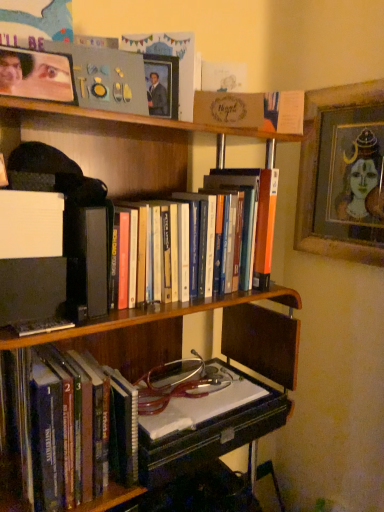
Describe the element at coordinates (141, 124) in the screenshot. I see `wooden bookcase at center` at that location.

I want to click on wooden bookcase at center, so click(x=141, y=124).

This screenshot has width=384, height=512. Describe the element at coordinates (36, 75) in the screenshot. I see `matte plastic picture frame at upper left, the 1th picture frame positioned from the front` at that location.

Based on the photo, how much space does wooden framed portrait at upper right, placed as the 3th picture frame when sorted from left to right, occupy horizontally?

2.06 inches.

At what (x,y) coordinates should I click in order to perform the action: click on wooden picture frame at upper center, positioned as the 2th picture frame in back-to-front order. Please return your answer as a coordinate pair (x, y). This screenshot has height=512, width=384. Looking at the image, I should click on (162, 85).

From the image's perspective, would you say hardcover books at left, which is the 2th book in top-to-bottom order, is positioned over hardcover books at center, arranged as the second book when ordered from the bottom?

No.

Is hardcover books at left, which is the 2th book in top-to-bottom order, not within hardcover books at center, marked as the 1th book in a top-to-bottom arrangement?

Yes, hardcover books at left, which is the 2th book in top-to-bottom order, is located beyond the bounds of hardcover books at center, marked as the 1th book in a top-to-bottom arrangement.

Relative to hardcover books at center, arranged as the second book when ordered from the bottom, is hardcover books at left, which is the 2th book in top-to-bottom order, in front or behind?

In the image, hardcover books at left, which is the 2th book in top-to-bottom order, appears behind hardcover books at center, arranged as the second book when ordered from the bottom.

Can you see hardcover books at left, the first book from the bottom, touching hardcover books at center, marked as the 1th book in a top-to-bottom arrangement?

hardcover books at left, the first book from the bottom, and hardcover books at center, marked as the 1th book in a top-to-bottom arrangement, are clearly separated.

Does wooden bookcase at center appear on the right side of hardcover books at center, marked as the 1th book in a top-to-bottom arrangement?

No.

Which object is thinner, wooden bookcase at center or hardcover books at center, arranged as the second book when ordered from the bottom?

hardcover books at center, arranged as the second book when ordered from the bottom.

From the image's perspective, is wooden bookcase at center positioned above or below hardcover books at center, arranged as the second book when ordered from the bottom?

Clearly, from the image's perspective, wooden bookcase at center is below hardcover books at center, arranged as the second book when ordered from the bottom.

Can we say wooden bookcase at center lies outside hardcover books at center, arranged as the second book when ordered from the bottom?

wooden bookcase at center is positioned outside hardcover books at center, arranged as the second book when ordered from the bottom.

Can you confirm if hardcover books at left, which is the 2th book in top-to-bottom order, is thinner than wooden framed portrait at upper right, the first picture frame positioned from the right?

No, hardcover books at left, which is the 2th book in top-to-bottom order, is not thinner than wooden framed portrait at upper right, the first picture frame positioned from the right.

How different are the orientations of hardcover books at left, the first book from the bottom, and wooden framed portrait at upper right, placed as the 3th picture frame when sorted from left to right, in degrees?

The angular difference between hardcover books at left, the first book from the bottom, and wooden framed portrait at upper right, placed as the 3th picture frame when sorted from left to right, is 85.4 degrees.

Is hardcover books at left, which is the 2th book in top-to-bottom order, not near wooden framed portrait at upper right, the first picture frame viewed from the back?

Yes, hardcover books at left, which is the 2th book in top-to-bottom order, and wooden framed portrait at upper right, the first picture frame viewed from the back, are quite far apart.

In the scene shown: Can we say hardcover books at left, which is the 2th book in top-to-bottom order, lies outside wooden framed portrait at upper right, the first picture frame positioned from the right?

Yes, hardcover books at left, which is the 2th book in top-to-bottom order, is located beyond the bounds of wooden framed portrait at upper right, the first picture frame positioned from the right.

Looking at the image, does matte plastic picture frame at upper left, the 1th picture frame positioned from the front, seem bigger or smaller compared to hardcover books at left, which is the 2th book in top-to-bottom order?

Considering their sizes, matte plastic picture frame at upper left, the 1th picture frame positioned from the front, takes up less space than hardcover books at left, which is the 2th book in top-to-bottom order.

Is matte plastic picture frame at upper left, which is counted as the third picture frame, starting from the right, outside of hardcover books at left, the first book from the bottom?

Yes, matte plastic picture frame at upper left, which is counted as the third picture frame, starting from the right, is outside of hardcover books at left, the first book from the bottom.

Based on their positions, is matte plastic picture frame at upper left, the 1th picture frame positioned from the front, located to the left or right of hardcover books at left, which is the 2th book in top-to-bottom order?

Based on their positions, matte plastic picture frame at upper left, the 1th picture frame positioned from the front, is located to the right of hardcover books at left, which is the 2th book in top-to-bottom order.

Is matte plastic picture frame at upper left, which ranks as the third picture frame in back-to-front order, in contact with hardcover books at left, which is the 2th book in top-to-bottom order?

No, matte plastic picture frame at upper left, which ranks as the third picture frame in back-to-front order, is not beside hardcover books at left, which is the 2th book in top-to-bottom order.

Considering the relative sizes of matte plastic picture frame at upper left, which is counted as the third picture frame, starting from the right, and wooden picture frame at upper center, positioned as the 2th picture frame in back-to-front order, in the image provided, is matte plastic picture frame at upper left, which is counted as the third picture frame, starting from the right, shorter than wooden picture frame at upper center, positioned as the 2th picture frame in back-to-front order,?

No, matte plastic picture frame at upper left, which is counted as the third picture frame, starting from the right, is not shorter than wooden picture frame at upper center, positioned as the 2th picture frame in back-to-front order.

Between point (6, 83) and point (147, 88), which one is positioned behind?

The point (147, 88) is more distant.

Is matte plastic picture frame at upper left, the 1th picture frame viewed from the left, aimed at wooden picture frame at upper center, which is the 2th picture frame from left to right?

No, matte plastic picture frame at upper left, the 1th picture frame viewed from the left, is not oriented towards wooden picture frame at upper center, which is the 2th picture frame from left to right.

Identify the location of book that is the 2nd one when counting upward from the wooden bookcase at center (from the image's perspective). The image size is (384, 512). [x=250, y=218].

Considering the relative positions of hardcover books at center, arranged as the second book when ordered from the bottom, and wooden bookcase at center in the image provided, is hardcover books at center, arranged as the second book when ordered from the bottom, to the left of wooden bookcase at center from the viewer's perspective?

In fact, hardcover books at center, arranged as the second book when ordered from the bottom, is to the right of wooden bookcase at center.

From a real-world perspective, is hardcover books at center, marked as the 1th book in a top-to-bottom arrangement, above or below hardcover books at left, which is the 2th book in top-to-bottom order?

hardcover books at center, marked as the 1th book in a top-to-bottom arrangement, is above hardcover books at left, which is the 2th book in top-to-bottom order.

From the image's perspective, between hardcover books at center, arranged as the second book when ordered from the bottom, and hardcover books at left, the first book from the bottom, which one is located above?

hardcover books at center, arranged as the second book when ordered from the bottom, appears higher in the image.

Which object is further away from the camera, hardcover books at center, marked as the 1th book in a top-to-bottom arrangement, or hardcover books at left, which is the 2th book in top-to-bottom order?

Positioned behind is hardcover books at left, which is the 2th book in top-to-bottom order.

Looking at their sizes, would you say hardcover books at center, arranged as the second book when ordered from the bottom, is wider or thinner than hardcover books at left, the first book from the bottom?

Clearly, hardcover books at center, arranged as the second book when ordered from the bottom, has less width compared to hardcover books at left, the first book from the bottom.

The width and height of the screenshot is (384, 512). I want to click on book on the right of hardcover books at left, the first book from the bottom, so click(250, 218).

At what (x,y) coordinates should I click in order to perform the action: click on book that is the 2nd object located above the wooden bookcase at center (from the image's perspective). Please return your answer as a coordinate pair (x, y). Image resolution: width=384 pixels, height=512 pixels. Looking at the image, I should click on (250, 218).

Estimate the real-world distances between objects in this image. Which object is further from wooden bookcase at center, hardcover books at center, marked as the 1th book in a top-to-bottom arrangement, or matte plastic picture frame at upper left, which is counted as the third picture frame, starting from the right?

matte plastic picture frame at upper left, which is counted as the third picture frame, starting from the right.

Considering their positions, is wooden bookcase at center positioned closer to wooden framed portrait at upper right, placed as the 3th picture frame when sorted from left to right, than hardcover books at left, the first book from the bottom?

wooden bookcase at center is closer to wooden framed portrait at upper right, placed as the 3th picture frame when sorted from left to right.

Which object lies further to the anchor point wooden picture frame at upper center, which is the 2th picture frame from left to right, wooden bookcase at center or hardcover books at center, arranged as the second book when ordered from the bottom?

hardcover books at center, arranged as the second book when ordered from the bottom, lies further to wooden picture frame at upper center, which is the 2th picture frame from left to right, than the other object.

Based on their spatial positions, is wooden picture frame at upper center, the second picture frame positioned from the right, or matte plastic picture frame at upper left, which is counted as the third picture frame, starting from the right, further from wooden framed portrait at upper right, the first picture frame positioned from the right?

matte plastic picture frame at upper left, which is counted as the third picture frame, starting from the right, is further to wooden framed portrait at upper right, the first picture frame positioned from the right.

Which object lies further to the anchor point matte plastic picture frame at upper left, which is counted as the third picture frame, starting from the right, hardcover books at center, arranged as the second book when ordered from the bottom, or wooden bookcase at center?

Based on the image, hardcover books at center, arranged as the second book when ordered from the bottom, appears to be further to matte plastic picture frame at upper left, which is counted as the third picture frame, starting from the right.

Looking at this image, considering their positions, is matte plastic picture frame at upper left, the 1th picture frame positioned from the front, positioned closer to wooden picture frame at upper center, which is the 2th picture frame from left to right, than wooden framed portrait at upper right, which appears as the 3th picture frame when viewed from the front?

matte plastic picture frame at upper left, the 1th picture frame positioned from the front, lies closer to wooden picture frame at upper center, which is the 2th picture frame from left to right, than the other object.

Considering their positions, is matte plastic picture frame at upper left, which ranks as the third picture frame in back-to-front order, positioned further to wooden framed portrait at upper right, the first picture frame viewed from the back, than wooden bookcase at center?

matte plastic picture frame at upper left, which ranks as the third picture frame in back-to-front order, is further to wooden framed portrait at upper right, the first picture frame viewed from the back.

Based on their spatial positions, is hardcover books at center, arranged as the second book when ordered from the bottom, or wooden framed portrait at upper right, the first picture frame positioned from the right, further from matte plastic picture frame at upper left, the 1th picture frame positioned from the front?

The object further to matte plastic picture frame at upper left, the 1th picture frame positioned from the front, is wooden framed portrait at upper right, the first picture frame positioned from the right.

At what (x,y) coordinates should I click in order to perform the action: click on book between matte plastic picture frame at upper left, the 1th picture frame positioned from the front, and hardcover books at left, which is the 2th book in top-to-bottom order, vertically. Please return your answer as a coordinate pair (x, y). The width and height of the screenshot is (384, 512). Looking at the image, I should click on (250, 218).

Locate an element on the screen. The width and height of the screenshot is (384, 512). bookcase located between matte plastic picture frame at upper left, the 1th picture frame positioned from the front, and wooden framed portrait at upper right, the first picture frame positioned from the right, in the left-right direction is located at coordinates (141, 124).

Where is `book between matte plastic picture frame at upper left, which is counted as the third picture frame, starting from the right, and wooden framed portrait at upper right, which appears as the 3th picture frame when viewed from the front`? The image size is (384, 512). book between matte plastic picture frame at upper left, which is counted as the third picture frame, starting from the right, and wooden framed portrait at upper right, which appears as the 3th picture frame when viewed from the front is located at coordinates (250, 218).

Image resolution: width=384 pixels, height=512 pixels. Find the location of `book that lies between wooden picture frame at upper center, the second picture frame positioned from the right, and hardcover books at left, the first book from the bottom, from top to bottom`. book that lies between wooden picture frame at upper center, the second picture frame positioned from the right, and hardcover books at left, the first book from the bottom, from top to bottom is located at coordinates (250, 218).